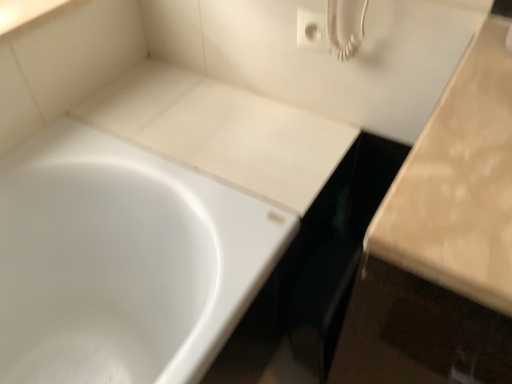
This screenshot has width=512, height=384. In order to click on beige textured countertop at upper right in this screenshot , I will do click(459, 183).

The width and height of the screenshot is (512, 384). Describe the element at coordinates (459, 183) in the screenshot. I see `beige textured countertop at upper right` at that location.

In order to click on beige textured countertop at upper right in this screenshot , I will do `click(459, 183)`.